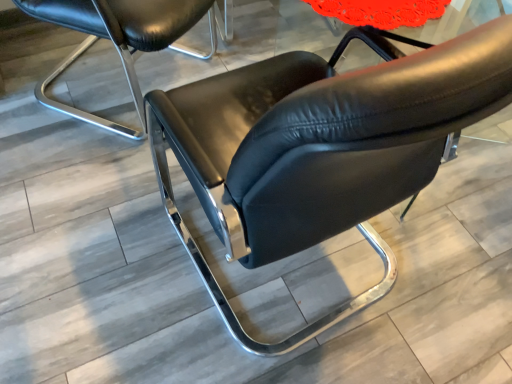
Where is `free space in front of matte black chair at center, which is the 2th chair from right to left`? free space in front of matte black chair at center, which is the 2th chair from right to left is located at coordinates (83, 193).